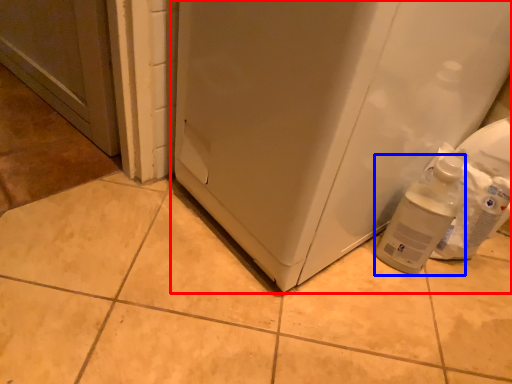
Question: Among these objects, which one is nearest to the camera, refrigerator (highlighted by a red box) or bottle (highlighted by a blue box)?

Choices:
 (A) refrigerator
 (B) bottle

Answer: (A)